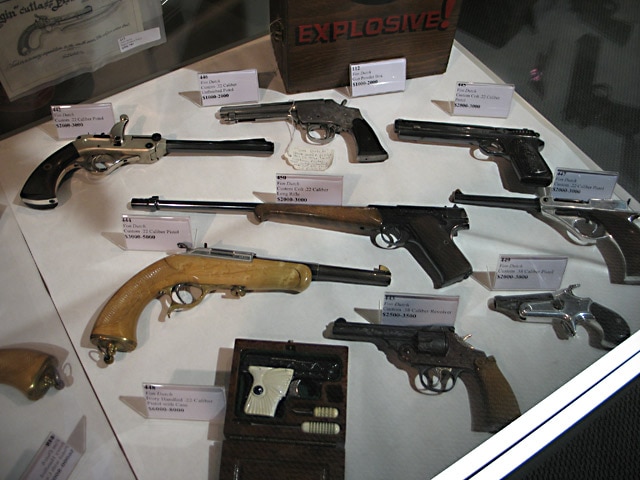
The image size is (640, 480). Find the location of `handles`. handles is located at coordinates (20, 363), (118, 320), (33, 168), (368, 148), (534, 170), (634, 254), (614, 315), (491, 395), (272, 398).